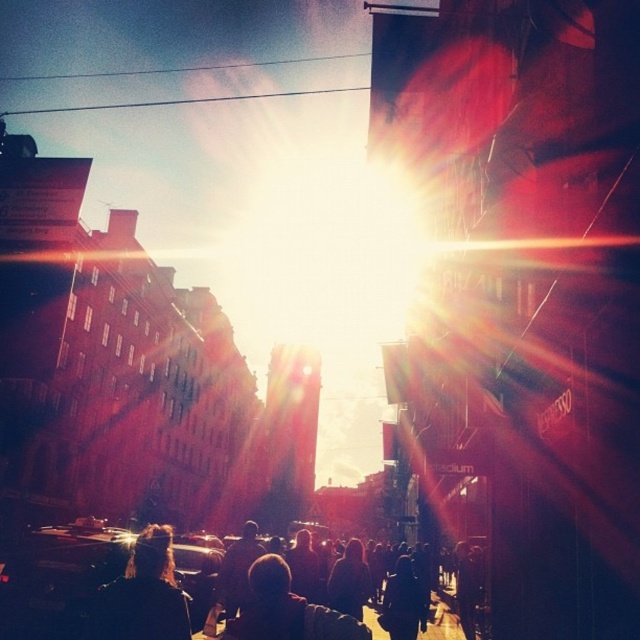
You are standing at the point closest to the camera in the image. Which point, point [102,621] or point [284,593], are you standing on?

You are standing on point [102,621] because it is in front of point [284,593].

You are a photographer standing in the urban scene and notice two people with dark hair. One has dark hair at lower left and the other has dark hair at center. Which person is positioned more to the left?

The dark hair at lower left is positioned to the left of dark hair at center, so the person with dark hair at lower left is more to the left.